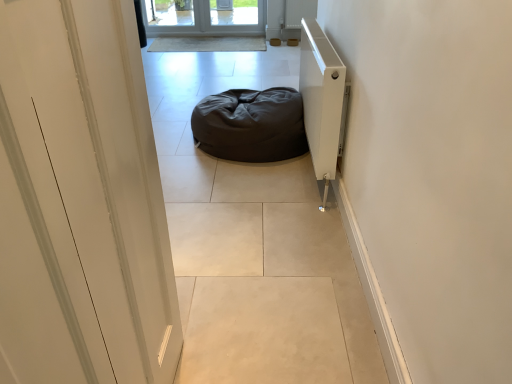
Question: In the image, is dark matte bean bag at center positioned in front of or behind dark brown fabric bean bag at center?

Choices:
 (A) front
 (B) behind

Answer: (A)

Question: From a real-world perspective, is dark matte bean bag at center positioned above or below dark brown fabric bean bag at center?

Choices:
 (A) below
 (B) above

Answer: (A)

Question: Which is farther from the white matte radiator at right?

Choices:
 (A) dark matte bean bag at center
 (B) dark brown fabric bean bag at center
 (C) white glossy door at left

Answer: (C)

Question: Which is nearer to the white glossy door at left?

Choices:
 (A) white matte radiator at right
 (B) dark matte bean bag at center
 (C) dark brown fabric bean bag at center

Answer: (B)